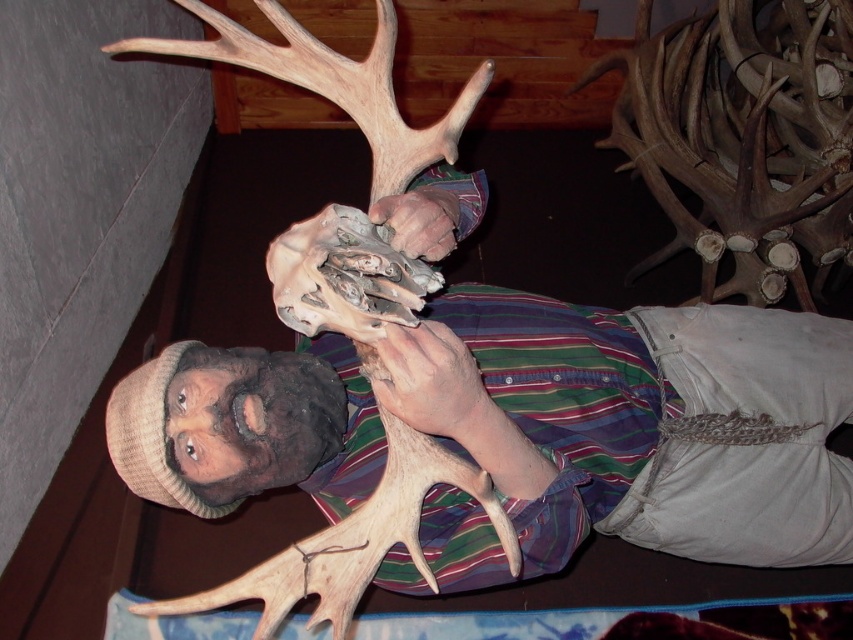
Is smooth tan skin at center smaller than matte brown hand at center?

Yes.

Is smooth tan skin at center positioned at the back of matte brown hand at center?

No, smooth tan skin at center is in front of matte brown hand at center.

Between point (444, 385) and point (439, 216), which one is positioned in front?

Point (444, 385) is more forward.

Identify the location of smooth tan skin at center. (434, 384).